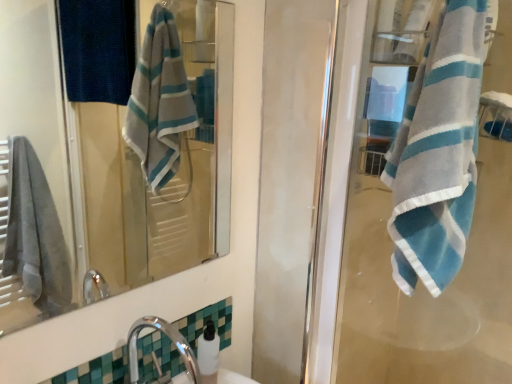
Question: From a real-world perspective, is white glossy soap dispenser at lower center under blue striped towel at right?

Choices:
 (A) yes
 (B) no

Answer: (A)

Question: Does white glossy soap dispenser at lower center come in front of blue striped towel at right?

Choices:
 (A) no
 (B) yes

Answer: (A)

Question: Can you confirm if white glossy soap dispenser at lower center is wider than blue striped towel at right?

Choices:
 (A) no
 (B) yes

Answer: (A)

Question: From a real-world perspective, is white glossy soap dispenser at lower center on blue striped towel at right?

Choices:
 (A) yes
 (B) no

Answer: (B)

Question: Is white glossy soap dispenser at lower center positioned with its back to blue striped towel at right?

Choices:
 (A) no
 (B) yes

Answer: (A)

Question: Can blue striped towel at right be found inside white glossy soap dispenser at lower center?

Choices:
 (A) yes
 (B) no

Answer: (B)

Question: Is chrome metallic faucet at lower left closer to camera compared to matte glass mirror at upper center?

Choices:
 (A) no
 (B) yes

Answer: (A)

Question: From a real-world perspective, is chrome metallic faucet at lower left below matte glass mirror at upper center?

Choices:
 (A) no
 (B) yes

Answer: (B)

Question: Is chrome metallic faucet at lower left far from matte glass mirror at upper center?

Choices:
 (A) yes
 (B) no

Answer: (A)

Question: Does chrome metallic faucet at lower left lie behind matte glass mirror at upper center?

Choices:
 (A) yes
 (B) no

Answer: (A)

Question: From a real-world perspective, is chrome metallic faucet at lower left positioned over matte glass mirror at upper center based on gravity?

Choices:
 (A) no
 (B) yes

Answer: (A)

Question: Is chrome metallic faucet at lower left to the left of matte glass mirror at upper center from the viewer's perspective?

Choices:
 (A) no
 (B) yes

Answer: (A)

Question: Does chrome metallic faucet at lower left have a lesser height compared to white glossy soap dispenser at lower center?

Choices:
 (A) no
 (B) yes

Answer: (A)